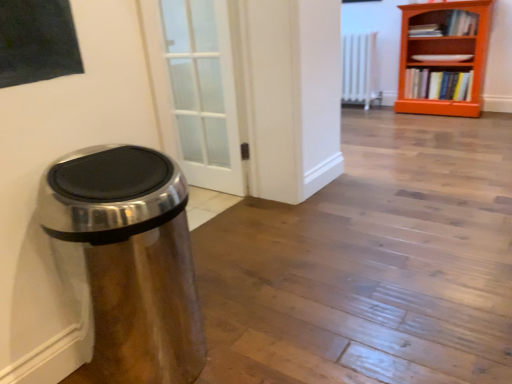
In order to click on unoccupied region to the right of satin metallic trash can at left in this screenshot , I will do `click(260, 338)`.